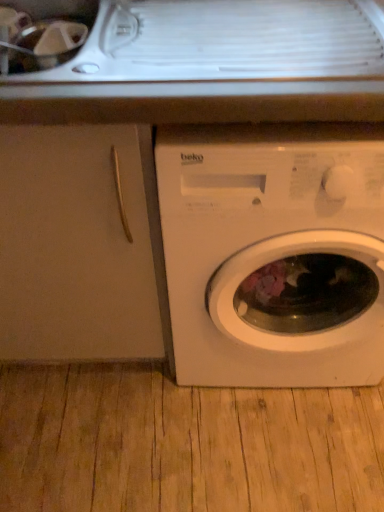
Question: Would you say white matte washing machine at lower right is outside matte white cabinet at left?

Choices:
 (A) yes
 (B) no

Answer: (A)

Question: Can you confirm if white matte washing machine at lower right is shorter than matte white cabinet at left?

Choices:
 (A) yes
 (B) no

Answer: (B)

Question: Does white matte washing machine at lower right have a greater height compared to matte white cabinet at left?

Choices:
 (A) yes
 (B) no

Answer: (A)

Question: Is white matte washing machine at lower right with matte white cabinet at left?

Choices:
 (A) yes
 (B) no

Answer: (B)

Question: Is matte white cabinet at left inside white matte washing machine at lower right?

Choices:
 (A) no
 (B) yes

Answer: (A)

Question: From the image's perspective, would you say white matte washing machine at lower right is shown under matte white cabinet at left?

Choices:
 (A) no
 (B) yes

Answer: (B)

Question: Does matte white cabinet at left have a larger size compared to white matte washing machine at lower right?

Choices:
 (A) no
 (B) yes

Answer: (B)

Question: Is matte white cabinet at left to the right of white matte washing machine at lower right from the viewer's perspective?

Choices:
 (A) yes
 (B) no

Answer: (B)

Question: Considering the relative positions of matte white cabinet at left and white matte washing machine at lower right in the image provided, is matte white cabinet at left to the left of white matte washing machine at lower right from the viewer's perspective?

Choices:
 (A) yes
 (B) no

Answer: (A)

Question: Would you say matte white cabinet at left is outside white matte washing machine at lower right?

Choices:
 (A) no
 (B) yes

Answer: (B)

Question: Is matte white cabinet at left oriented away from white matte washing machine at lower right?

Choices:
 (A) yes
 (B) no

Answer: (B)

Question: From a real-world perspective, is matte white cabinet at left beneath white matte washing machine at lower right?

Choices:
 (A) no
 (B) yes

Answer: (A)

Question: Considering their positions, is matte white cabinet at left located in front of or behind white matte washing machine at lower right?

Choices:
 (A) behind
 (B) front

Answer: (A)